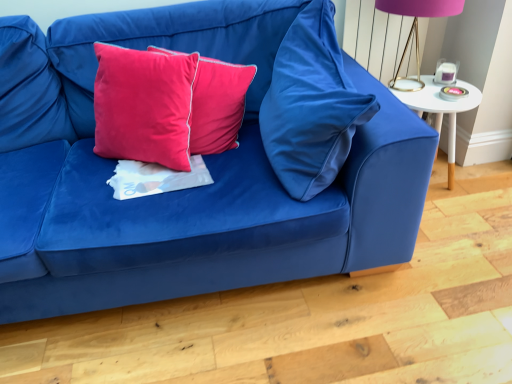
Question: Is velvet blue couch at center smaller than white glossy side table at right?

Choices:
 (A) yes
 (B) no

Answer: (B)

Question: Are velvet blue couch at center and white glossy side table at right located far from each other?

Choices:
 (A) no
 (B) yes

Answer: (A)

Question: Can you confirm if velvet blue couch at center is positioned to the left of white glossy side table at right?

Choices:
 (A) no
 (B) yes

Answer: (B)

Question: Considering the relative sizes of velvet blue couch at center and white glossy side table at right in the image provided, is velvet blue couch at center shorter than white glossy side table at right?

Choices:
 (A) yes
 (B) no

Answer: (B)

Question: Is velvet blue couch at center touching white glossy side table at right?

Choices:
 (A) no
 (B) yes

Answer: (A)

Question: Is point (109, 26) closer or farther from the camera than point (200, 182)?

Choices:
 (A) farther
 (B) closer

Answer: (A)

Question: Is velvet blue couch at center bigger or smaller than white matte sheet at center?

Choices:
 (A) small
 (B) big

Answer: (B)

Question: From a real-world perspective, is velvet blue couch at center positioned above or below white matte sheet at center?

Choices:
 (A) above
 (B) below

Answer: (A)

Question: In the image, is velvet blue couch at center positioned in front of or behind white matte sheet at center?

Choices:
 (A) front
 (B) behind

Answer: (A)

Question: Is point (406, 84) closer or farther from the camera than point (253, 259)?

Choices:
 (A) farther
 (B) closer

Answer: (A)

Question: In the image, is purple fabric lampshade at upper right on the left side or the right side of velvet blue couch at center?

Choices:
 (A) left
 (B) right

Answer: (B)

Question: Looking at their shapes, would you say purple fabric lampshade at upper right is wider or thinner than velvet blue couch at center?

Choices:
 (A) thin
 (B) wide

Answer: (A)

Question: In terms of height, does purple fabric lampshade at upper right look taller or shorter compared to velvet blue couch at center?

Choices:
 (A) tall
 (B) short

Answer: (B)

Question: From the image's perspective, is velvet blue pillow at center, placed as the 3th pillow when sorted from left to right, above or below velvet blue couch at center?

Choices:
 (A) below
 (B) above

Answer: (B)

Question: Would you say velvet blue pillow at center, placed as the 3th pillow when sorted from left to right, is to the left or to the right of velvet blue couch at center in the picture?

Choices:
 (A) right
 (B) left

Answer: (A)